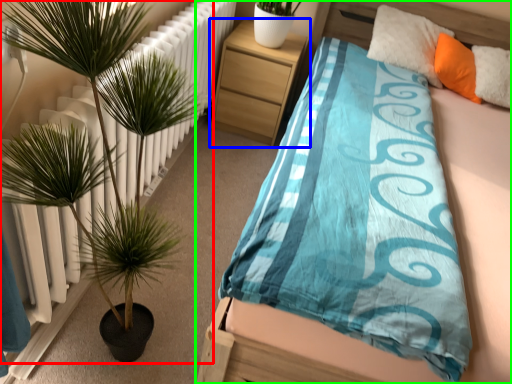
Question: Estimate the real-world distances between objects in this image. Which object is closer to houseplant (highlighted by a red box), nightstand (highlighted by a blue box) or bed (highlighted by a green box)?

Choices:
 (A) nightstand
 (B) bed

Answer: (B)